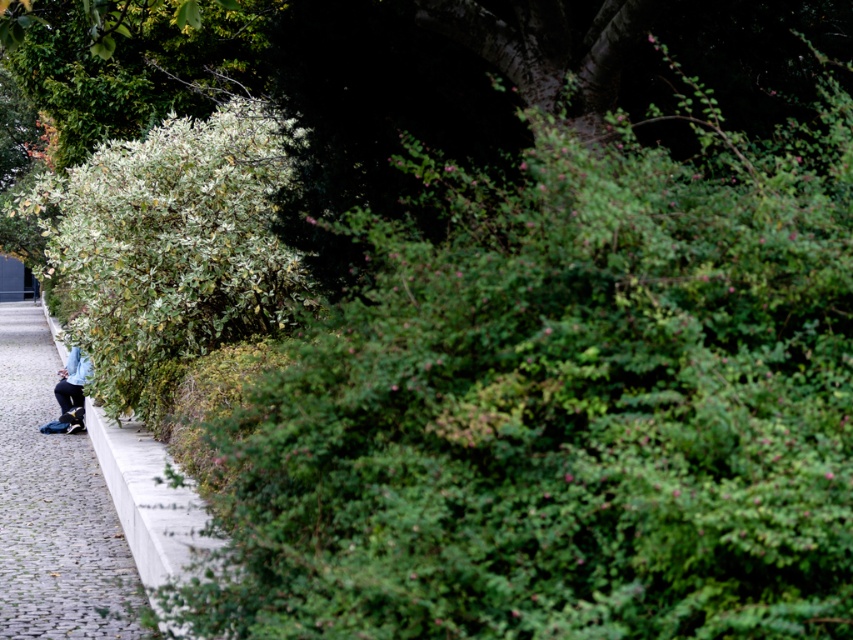
Which is more to the right, green matte bush at left or light blue fabric at lower left?

From the viewer's perspective, light blue fabric at lower left appears more on the right side.

Is point (294, 321) more distant than point (57, 400)?

No, (294, 321) is closer to viewer.

Find the location of a particular element. The image size is (853, 640). green matte bush at left is located at coordinates (170, 250).

Does gray concrete pavement at lower left appear over light blue fabric at lower left?

No.

Between gray concrete pavement at lower left and light blue fabric at lower left, which one has less height?

gray concrete pavement at lower left

Does point (57, 460) lie behind point (73, 369)?

No, it is not.

Image resolution: width=853 pixels, height=640 pixels. I want to click on gray concrete pavement at lower left, so click(x=54, y=506).

Which is more to the right, green matte bush at left or gray concrete pavement at lower left?

green matte bush at left is more to the right.

Between green matte bush at left and gray concrete pavement at lower left, which one is positioned lower?

Positioned lower is gray concrete pavement at lower left.

Does point (196, 147) come behind point (15, 577)?

Yes.

You are a GUI agent. You are given a task and a screenshot of the screen. Output one action in this format:
    pyautogui.click(x=<x>, y=<y>)
    Task: Click on the green matte bush at left
    The height and width of the screenshot is (640, 853).
    Given the screenshot: What is the action you would take?
    pyautogui.click(x=170, y=250)